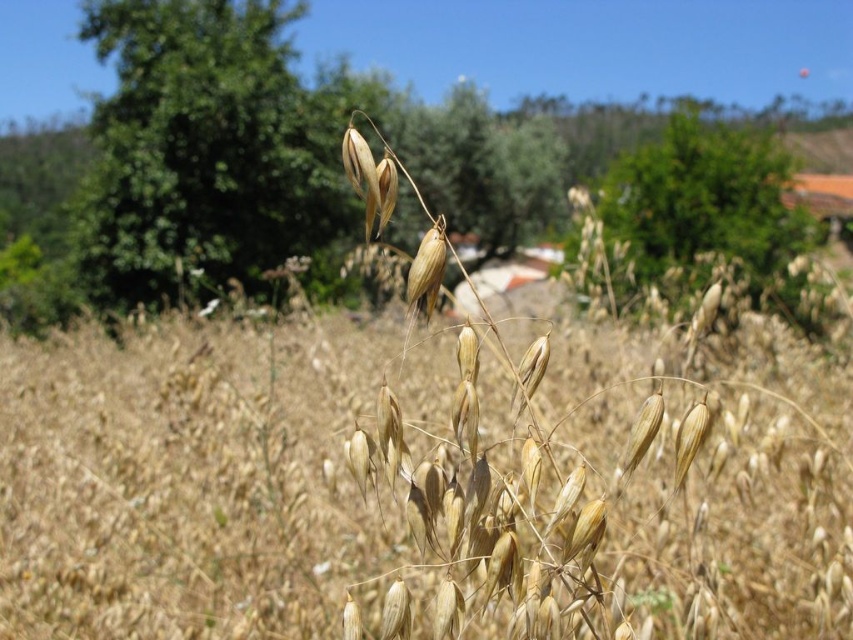
Question: Among these objects, which one is farthest from the camera?

Choices:
 (A) green leafy tree at upper center
 (B) dry straw wheat at center

Answer: (A)

Question: Which object is closer to the camera taking this photo?

Choices:
 (A) green leafy tree at upper center
 (B) dry straw wheat at center

Answer: (B)

Question: Does dry straw wheat at center have a greater width compared to green leafy tree at upper center?

Choices:
 (A) no
 (B) yes

Answer: (A)

Question: Is dry straw wheat at center below green leafy tree at upper center?

Choices:
 (A) no
 (B) yes

Answer: (B)

Question: Which point is farther to the camera?

Choices:
 (A) green leafy tree at upper center
 (B) dry straw wheat at center

Answer: (A)

Question: Is dry straw wheat at center wider than green leafy tree at upper center?

Choices:
 (A) no
 (B) yes

Answer: (A)